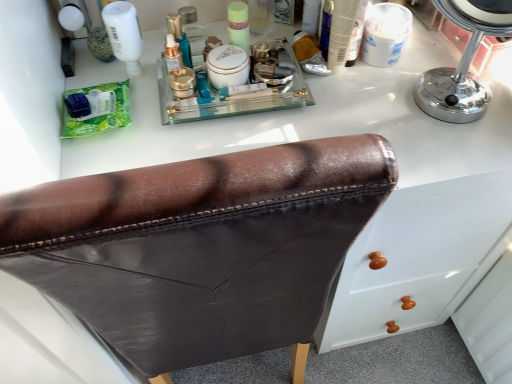
Image resolution: width=512 pixels, height=384 pixels. Find the location of `free space in front of green matte packet at left`. free space in front of green matte packet at left is located at coordinates (95, 154).